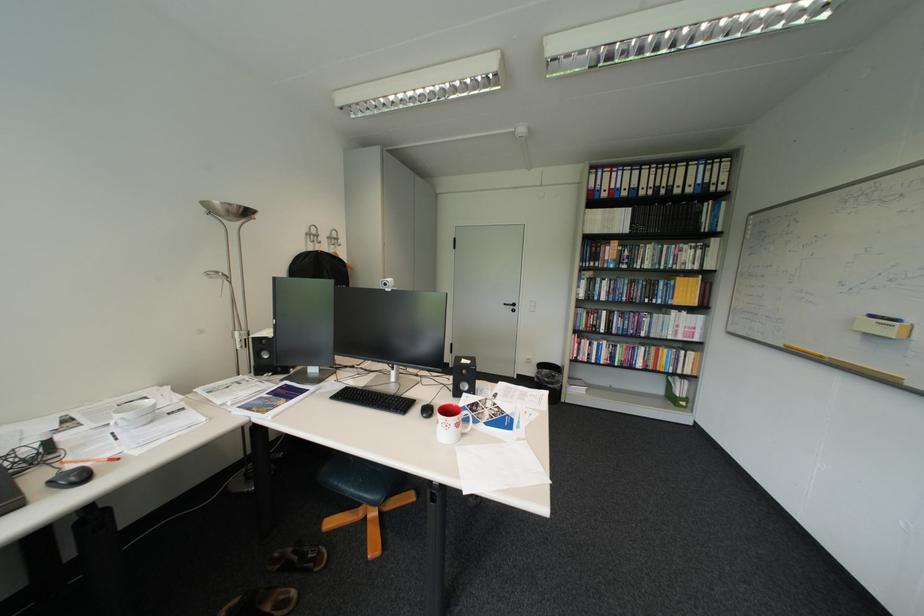
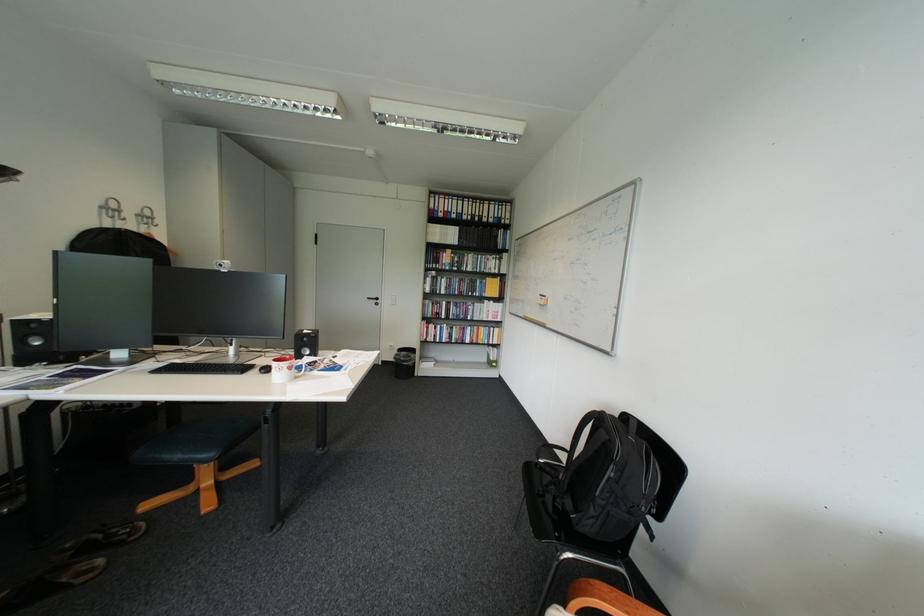
Question: The first image is from the beginning of the video and the second image is from the end. How did the camera likely rotate when shooting the video?

Choices:
 (A) Left
 (B) Right
 (C) Up
 (D) Down

Answer: (B)